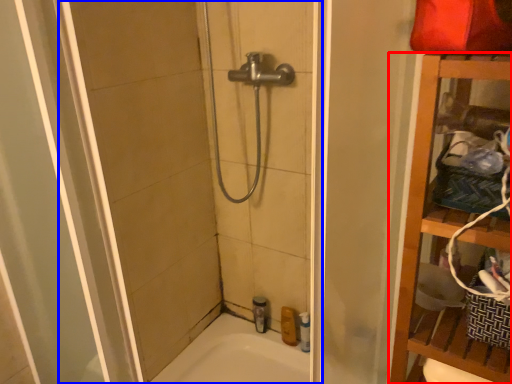
Question: Which object is closer to the camera taking this photo, furniture (highlighted by a red box) or shower door (highlighted by a blue box)?

Choices:
 (A) furniture
 (B) shower door

Answer: (B)